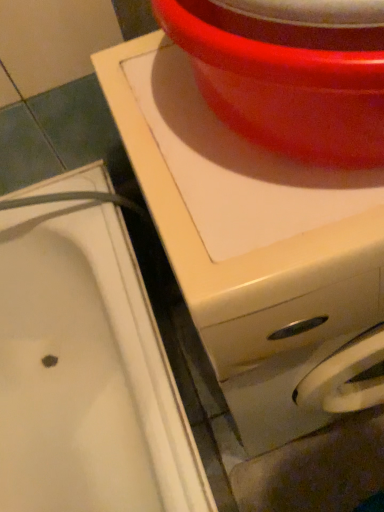
Question: Is point pyautogui.click(x=34, y=304) positioned closer to the camera than point pyautogui.click(x=377, y=139)?

Choices:
 (A) farther
 (B) closer

Answer: (A)

Question: From the image's perspective, relative to glossy plastic basin at upper center, is white glossy sink at lower left above or below?

Choices:
 (A) above
 (B) below

Answer: (B)

Question: Which of these objects is positioned closest to the glossy plastic basin at upper center?

Choices:
 (A) white glossy washing machine at upper center
 (B) white glossy sink at lower left

Answer: (A)

Question: Which is nearer to the white glossy washing machine at upper center?

Choices:
 (A) glossy plastic basin at upper center
 (B) white glossy sink at lower left

Answer: (A)